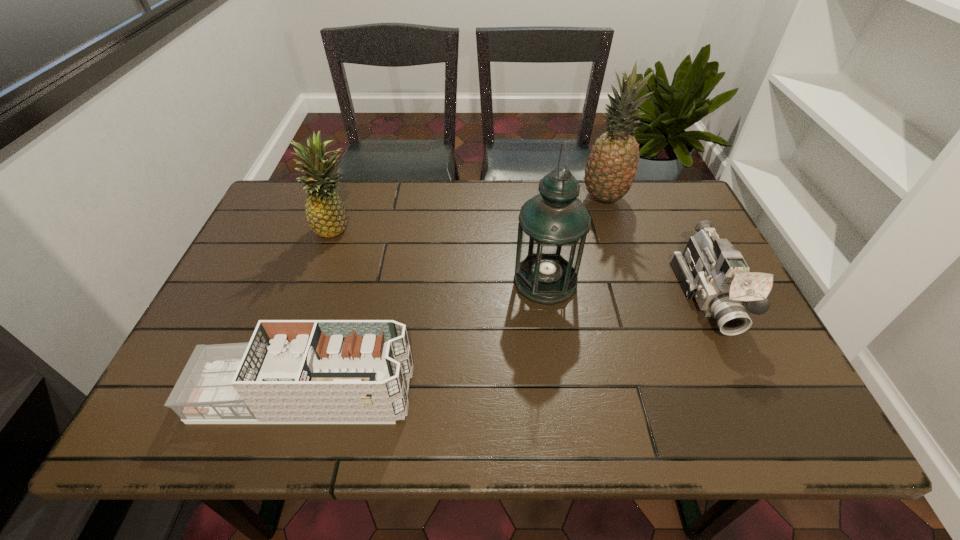
In the image, there is a desktop. Identify the location of vacant space at the near edge. The width and height of the screenshot is (960, 540). [633, 425].

I want to click on free point at the right edge, so (x=697, y=315).

Where is `vacant space at the far left corner of the desktop`? Image resolution: width=960 pixels, height=540 pixels. vacant space at the far left corner of the desktop is located at coordinates (273, 218).

This screenshot has height=540, width=960. What are the coordinates of `vacant region at the far right corner` in the screenshot? It's located at (649, 181).

Locate an element on the screen. Image resolution: width=960 pixels, height=540 pixels. free space between the shortest object and the farthest object is located at coordinates (454, 296).

I want to click on unoccupied position between the nearer pineapple and the oil lamp, so click(442, 254).

Identify the location of free space between the shortest object and the oil lamp. Image resolution: width=960 pixels, height=540 pixels. (425, 338).

This screenshot has height=540, width=960. In order to click on unoccupied area between the rightmost object and the shortest object in this screenshot , I will do `click(506, 345)`.

In order to click on free space between the nearer pineapple and the nearest object in this screenshot , I will do `click(322, 311)`.

Locate an element on the screen. vacant area that lies between the dollhouse and the farthest object is located at coordinates (454, 296).